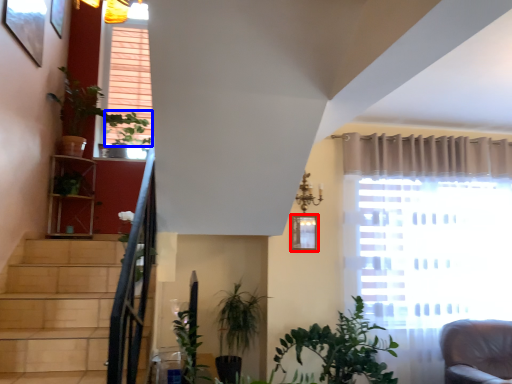
Question: Which point is further to the camera, picture frame (highlighted by a red box) or plant (highlighted by a blue box)?

Choices:
 (A) picture frame
 (B) plant

Answer: (B)